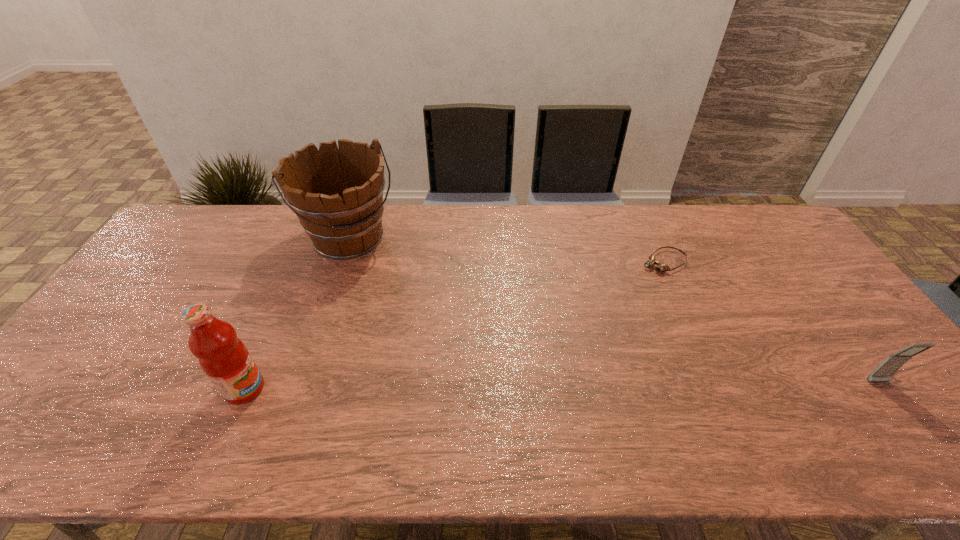
At what (x,y) coordinates should I click in order to perform the action: click on vacant space at the left edge. Please return your answer as a coordinate pair (x, y). The image size is (960, 540). Looking at the image, I should click on 176,266.

Where is `vacant space at the right edge`? The image size is (960, 540). vacant space at the right edge is located at coordinates (850, 312).

In the image, there is a desktop. Where is `free space at the far left corner`? This screenshot has height=540, width=960. free space at the far left corner is located at coordinates (227, 208).

Locate an element on the screen. The width and height of the screenshot is (960, 540). free spot at the far right corner of the desktop is located at coordinates (774, 221).

The width and height of the screenshot is (960, 540). I want to click on vacant space in between the goggles and the fruit juice, so click(454, 325).

Where is `free spot between the fruit juice and the wine bucket`? The image size is (960, 540). free spot between the fruit juice and the wine bucket is located at coordinates (298, 314).

Where is `empty location between the goggles and the fruit juice`? empty location between the goggles and the fruit juice is located at coordinates (454, 325).

Locate an element on the screen. vacant space that's between the second shortest object and the wine bucket is located at coordinates (614, 310).

Where is `free space that is in between the fruit juice and the third tallest object`? Image resolution: width=960 pixels, height=540 pixels. free space that is in between the fruit juice and the third tallest object is located at coordinates (562, 386).

Where is `free area in between the rightmost object and the wine bucket`? This screenshot has width=960, height=540. free area in between the rightmost object and the wine bucket is located at coordinates (614, 310).